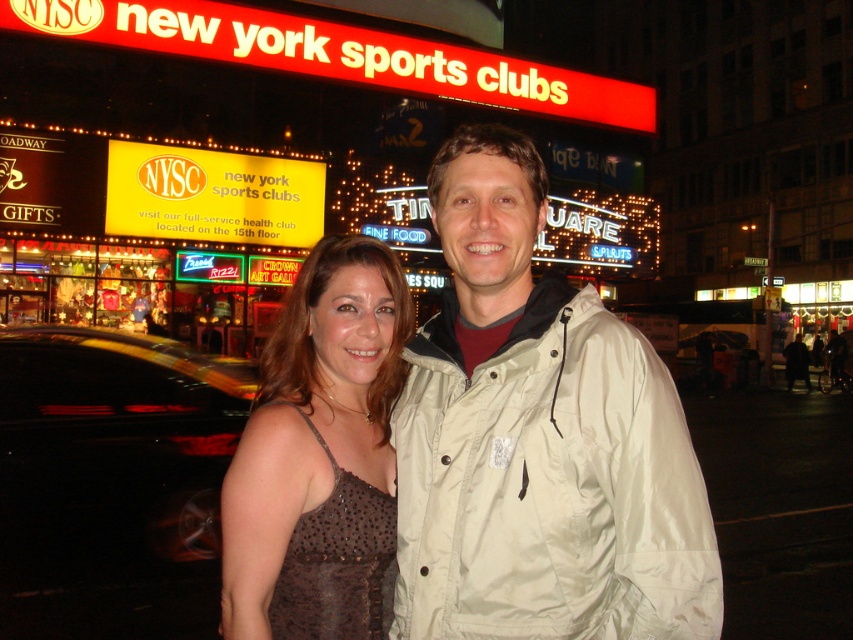
This screenshot has height=640, width=853. I want to click on light beige jacket at center, so click(x=538, y=440).

Does point (654, 442) come behind point (363, 596)?

No, (654, 442) is in front of (363, 596).

Does point (461, 460) lie behind point (311, 611)?

Yes, point (461, 460) is behind point (311, 611).

Locate an element on the screen. light beige jacket at center is located at coordinates (538, 440).